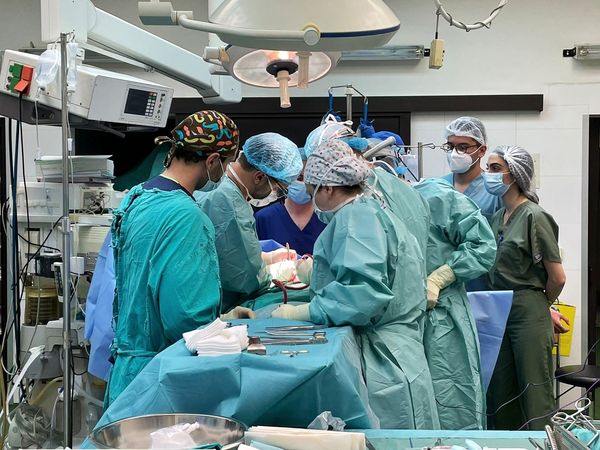
Find the location of a particular element. This screenshot has height=450, width=600. wall is located at coordinates (546, 155).